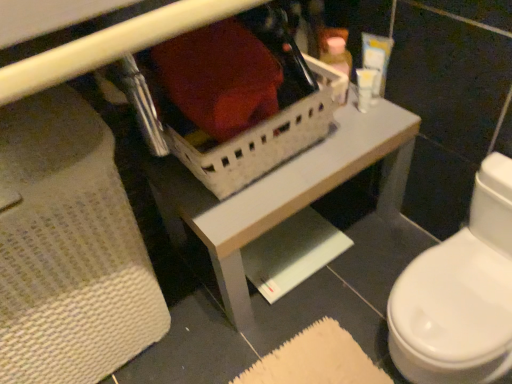
Image resolution: width=512 pixels, height=384 pixels. I want to click on free spot in front of white plastic container at upper right, marked as the third toiletry in a left-to-right arrangement, so click(367, 132).